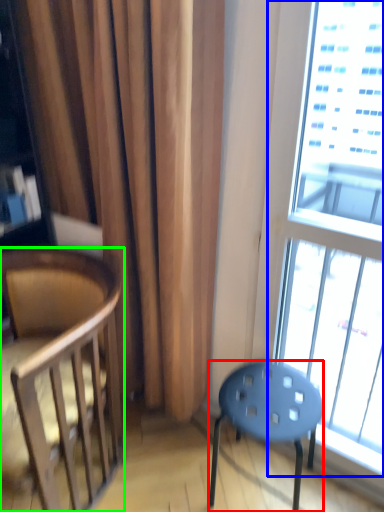
Question: Based on their relative distances, which object is nearer to stool (highlighted by a red box)? Choose from window (highlighted by a blue box) and chair (highlighted by a green box).

Choices:
 (A) window
 (B) chair

Answer: (B)